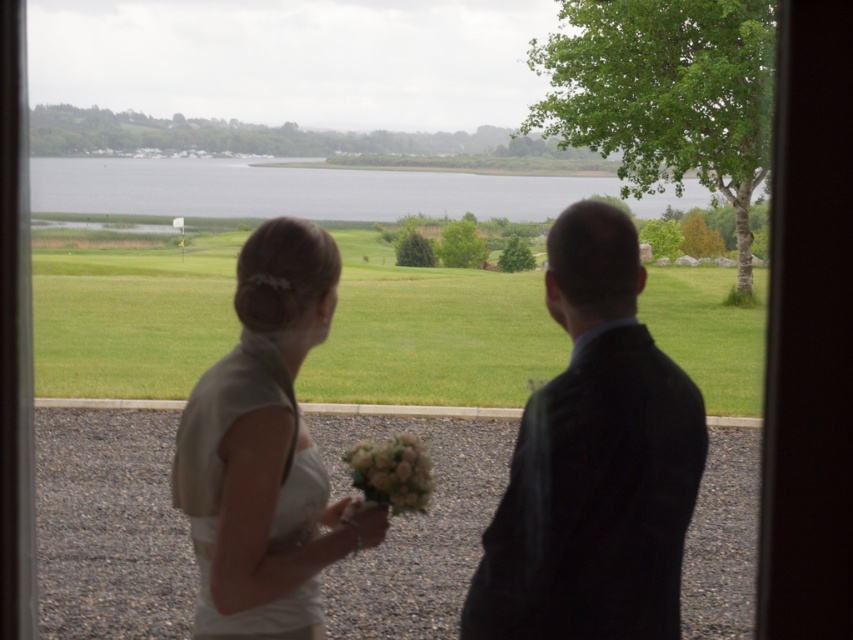
Question: Does white satin dress at center have a greater width compared to green grassy field at center?

Choices:
 (A) no
 (B) yes

Answer: (A)

Question: Observing the image, what is the correct spatial positioning of dark suit at center in reference to white satin dress at left?

Choices:
 (A) left
 (B) right

Answer: (B)

Question: Which point is closer to the camera taking this photo?

Choices:
 (A) (347, 516)
 (B) (466, 314)
 (C) (668, 516)
 (D) (189, 172)

Answer: (C)

Question: In this image, where is white satin dress at left located relative to clear water at center?

Choices:
 (A) below
 (B) above

Answer: (A)

Question: Which object is positioned closest to the white satin dress at left?

Choices:
 (A) green grassy field at center
 (B) dark suit at center

Answer: (B)

Question: Which point is farther from the camera taking this photo?

Choices:
 (A) (177, 438)
 (B) (178, 193)

Answer: (B)